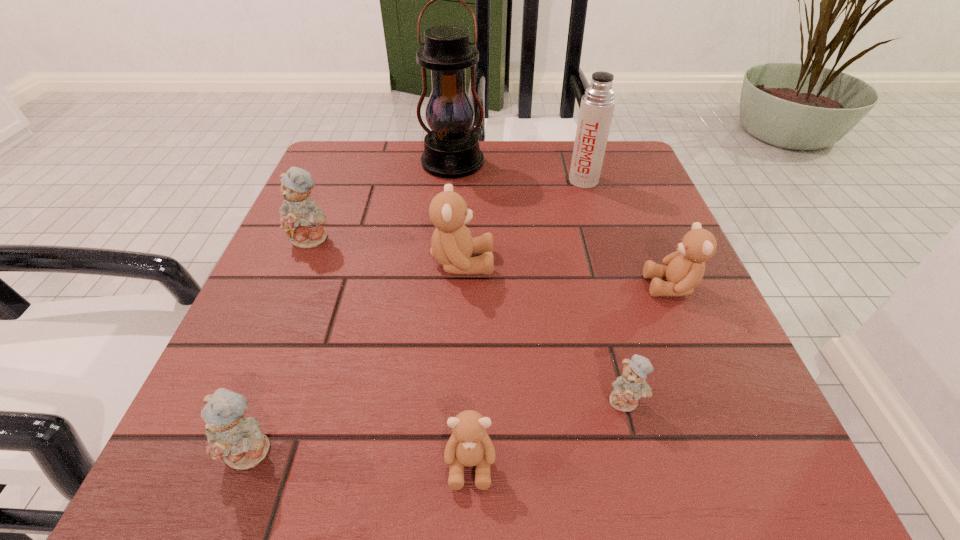
Where is `the nearest brown teddy bear`? The image size is (960, 540). the nearest brown teddy bear is located at coordinates (469, 445).

Can you find a vacant point located 0.050m above the tallest object, indicating its light source? Please provide its 2D coordinates. Your answer should be formatted as a tuple, i.e. [(x, y)], where the tuple contains the x and y coordinates of a point satisfying the conditions above.

[(450, 195)]

The height and width of the screenshot is (540, 960). I want to click on free space located 0.310m on the left of the seventh shortest object, so click(x=432, y=180).

Where is `free region located on the face of the biggest brown teddy bear`? Image resolution: width=960 pixels, height=540 pixels. free region located on the face of the biggest brown teddy bear is located at coordinates (575, 263).

Find the location of a particular element. The height and width of the screenshot is (540, 960). blank area located 0.170m on the front-facing side of the biggest blue teddy bear is located at coordinates (278, 320).

Image resolution: width=960 pixels, height=540 pixels. I want to click on blank space located on the face of the rightmost object, so click(588, 286).

What are the coordinates of `free region located on the face of the rightmost object` in the screenshot? It's located at (518, 286).

You are a GUI agent. You are given a task and a screenshot of the screen. Output one action in this format:
    pyautogui.click(x=<x>, y=<y>)
    Task: Click on the free location located 0.380m on the face of the rightmost object
    This screenshot has width=960, height=540.
    Given the screenshot: What is the action you would take?
    pyautogui.click(x=426, y=286)

This screenshot has height=540, width=960. In order to click on vacant space located 0.050m on the front-facing side of the rightmost blue teddy bear in this screenshot , I will do pos(638,451).

Find the location of a particular element. lantern situated at the far edge is located at coordinates (451, 149).